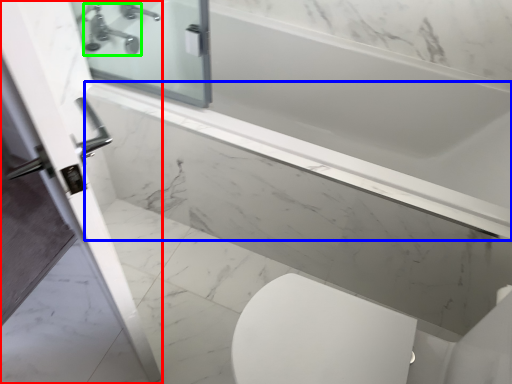
Question: Which object is positioned closest to screen door (highlighted by a red box)? Select from ledge (highlighted by a blue box) and tap (highlighted by a green box).

Choices:
 (A) ledge
 (B) tap

Answer: (A)